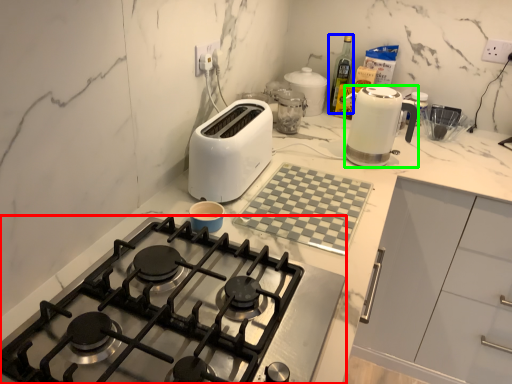
Question: Which is nearer to the gas stove (highlighted by a red box)? bottle (highlighted by a blue box) or kitchen appliance (highlighted by a green box).

Choices:
 (A) bottle
 (B) kitchen appliance

Answer: (B)